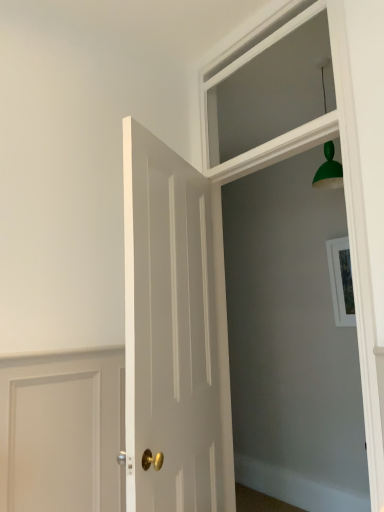
Question: In terms of height, does clear glass window at upper center look taller or shorter compared to white glossy door at center?

Choices:
 (A) short
 (B) tall

Answer: (A)

Question: From a real-world perspective, relative to white glossy door at center, is clear glass window at upper center vertically above or below?

Choices:
 (A) above
 (B) below

Answer: (A)

Question: Which is farther from the clear glass window at upper center?

Choices:
 (A) white glossy door at center
 (B) white wood frame at upper center

Answer: (A)

Question: Based on their relative distances, which object is farther from the white wood frame at upper center?

Choices:
 (A) white glossy door at center
 (B) clear glass window at upper center

Answer: (A)